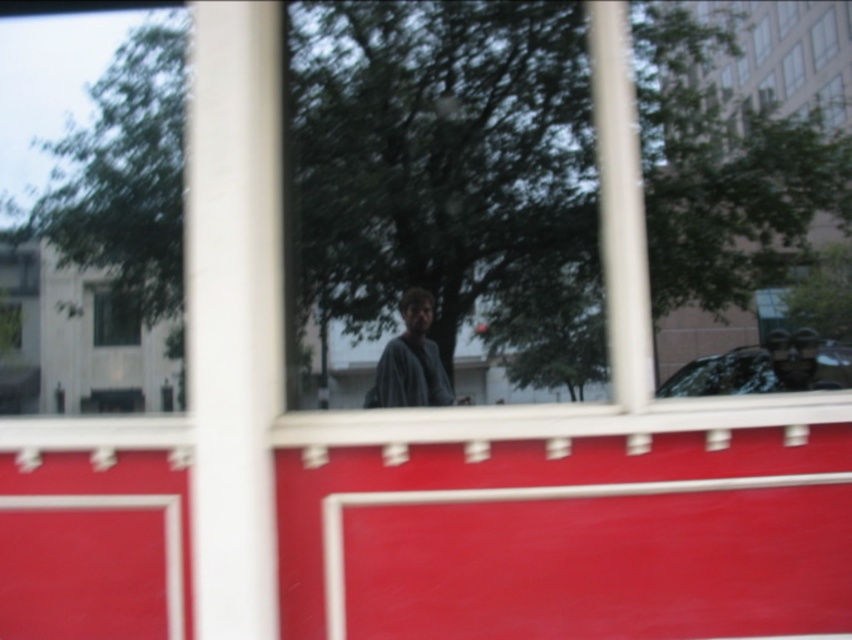
Question: Which point is closer to the camera?

Choices:
 (A) transparent glass window at upper left
 (B) clear glass window at upper right
 (C) transparent glass window at upper right
 (D) gray knit sweater at center

Answer: (D)

Question: Among these objects, which one is farthest from the camera?

Choices:
 (A) gray knit sweater at center
 (B) transparent glass window at upper left
 (C) clear glass window at upper right

Answer: (B)

Question: Which point is closer to the camera?

Choices:
 (A) transparent glass window at upper right
 (B) transparent glass window at upper left
 (C) clear glass window at upper right
 (D) gray knit sweater at center

Answer: (D)

Question: Is transparent glass window at upper left thinner than clear glass window at upper right?

Choices:
 (A) yes
 (B) no

Answer: (B)

Question: Does gray knit sweater at center appear under transparent glass window at upper right?

Choices:
 (A) no
 (B) yes

Answer: (B)

Question: Can you confirm if transparent glass window at upper left is positioned to the left of clear glass window at upper right?

Choices:
 (A) no
 (B) yes

Answer: (B)